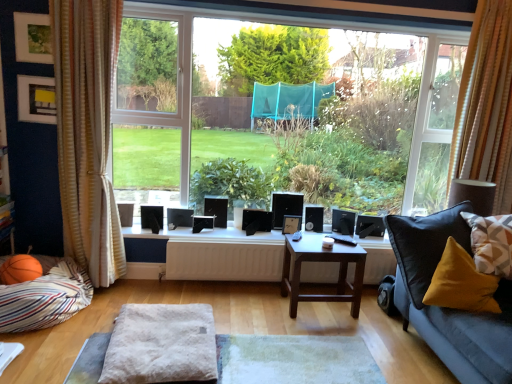
Where is `orange rubber basketball at lower left`? orange rubber basketball at lower left is located at coordinates (20, 269).

Where is `dark brown wooden table at center`? This screenshot has width=512, height=384. dark brown wooden table at center is located at coordinates (322, 261).

What do you see at coordinates (281, 111) in the screenshot?
I see `transparent glass window at center` at bounding box center [281, 111].

Identify the location of striped fabric pillow at lower left, which ranks as the first pillow in left-to-right order. Image resolution: width=512 pixels, height=384 pixels. (45, 297).

This screenshot has width=512, height=384. Identify the location of velvet yellow pillow at lower right, which appears as the second pillow when viewed from the right. (461, 283).

How much space does velvet yellow pillow at lower right, acting as the 2th pillow starting from the left, occupy horizontally?

It is 31.53 centimeters.

Identify the location of orange rubber basketball at lower left. (20, 269).

You are a GUI agent. You are given a task and a screenshot of the screen. Output one action in this format:
    pyautogui.click(x=<x>, y=<y>)
    Task: Click on the gray below the orange fabric curtain at right, which is the 2th curtain from left to right (from the image's perspective)
    
    Given the screenshot: What is the action you would take?
    pyautogui.click(x=161, y=345)

Considering the points (144, 348) and (465, 89), which point is behind, point (144, 348) or point (465, 89)?

The point (465, 89) is more distant.

Between fuzzy fabric ottoman at center and orange fabric curtain at right, arranged as the 1th curtain when viewed from the right, which one has larger size?

Bigger between the two is orange fabric curtain at right, arranged as the 1th curtain when viewed from the right.

Can we say fuzzy fabric ottoman at center lies outside orange fabric curtain at right, which is the 2th curtain from left to right?

Yes, fuzzy fabric ottoman at center is not within orange fabric curtain at right, which is the 2th curtain from left to right.

Looking at this image, can you confirm if orange rubber basketball at lower left is thinner than white glossy window sill at center?

Yes, orange rubber basketball at lower left is thinner than white glossy window sill at center.

From a real-world perspective, is orange rubber basketball at lower left above or below white glossy window sill at center?

From a real-world perspective, orange rubber basketball at lower left is physically below white glossy window sill at center.

Does orange rubber basketball at lower left have a smaller size compared to white glossy window sill at center?

Yes.

Locate an element on the screen. This screenshot has height=384, width=512. window sill that is on the right side of orange rubber basketball at lower left is located at coordinates (203, 234).

From a real-world perspective, is matte black picture frame at upper left, which is the first picture frame from left to right, physically located above or below geometric-patterned fabric pillow at right, positioned as the 1th pillow in right-to-left order?

matte black picture frame at upper left, which is the first picture frame from left to right, is above geometric-patterned fabric pillow at right, positioned as the 1th pillow in right-to-left order.

Is point (48, 110) behind point (504, 238)?

That is True.

From the image's perspective, count 2nd picture frames upward from the geometric-patterned fabric pillow at right, positioned as the 1th pillow in right-to-left order, and point to it. Please provide its 2D coordinates.

[(36, 99)]

From the image's perspective, which object appears higher, matte black picture frame at upper left, which is counted as the 2th picture frame, starting from the bottom, or geometric-patterned fabric pillow at right, placed as the 3th pillow when sorted from left to right?

matte black picture frame at upper left, which is counted as the 2th picture frame, starting from the bottom, appears higher in the image.

Is orange fabric curtain at right, arranged as the 1th curtain when viewed from the right, wider than matte green picture frame at upper left, which ranks as the third picture frame in back-to-front order?

Yes.

From the image's perspective, does orange fabric curtain at right, which is the 2th curtain from left to right, appear higher than matte green picture frame at upper left, placed as the 2th picture frame when sorted from right to left?

Incorrect, from the image's perspective, orange fabric curtain at right, which is the 2th curtain from left to right, is lower than matte green picture frame at upper left, placed as the 2th picture frame when sorted from right to left.

Looking at this image, considering the sizes of objects orange fabric curtain at right, arranged as the 1th curtain when viewed from the right, and matte green picture frame at upper left, placed as the 1th picture frame when sorted from front to back, in the image provided, who is taller, orange fabric curtain at right, arranged as the 1th curtain when viewed from the right, or matte green picture frame at upper left, placed as the 1th picture frame when sorted from front to back,?

orange fabric curtain at right, arranged as the 1th curtain when viewed from the right.

Do you think orange rubber basketball at lower left is within white matte radiator at center, or outside of it?

orange rubber basketball at lower left is outside white matte radiator at center.

Is orange rubber basketball at lower left next to white matte radiator at center?

orange rubber basketball at lower left and white matte radiator at center are not in contact.

Between orange rubber basketball at lower left and white matte radiator at center, which one has smaller width?

white matte radiator at center is thinner.

Based on the photo, considering the sizes of objects orange rubber basketball at lower left and white matte radiator at center in the image provided, who is taller, orange rubber basketball at lower left or white matte radiator at center?

white matte radiator at center is taller.

This screenshot has width=512, height=384. What are the coordinates of `curtain located on the left of fuzzy fabric ottoman at center` in the screenshot? It's located at (87, 132).

Does striped fabric curtain at left, arranged as the second curtain when viewed from the right, have a lesser height compared to fuzzy fabric ottoman at center?

No.

Would you say striped fabric curtain at left, the first curtain from the left, is to the left or to the right of fuzzy fabric ottoman at center in the picture?

striped fabric curtain at left, the first curtain from the left, is to the left of fuzzy fabric ottoman at center.

How different are the orientations of striped fabric curtain at left, arranged as the second curtain when viewed from the right, and fuzzy fabric ottoman at center in degrees?

There is a 4.51-degree angle between the facing directions of striped fabric curtain at left, arranged as the second curtain when viewed from the right, and fuzzy fabric ottoman at center.

Is matte green picture frame at upper left, placed as the 1th picture frame when sorted from front to back, outside of striped fabric curtain at left, the first curtain from the left?

Indeed, matte green picture frame at upper left, placed as the 1th picture frame when sorted from front to back, is completely outside striped fabric curtain at left, the first curtain from the left.

I want to click on the 1st picture frame counting from the left side of the striped fabric curtain at left, the first curtain from the left, so click(x=33, y=38).

How different are the orientations of matte green picture frame at upper left, placed as the 1th picture frame when sorted from front to back, and striped fabric curtain at left, the first curtain from the left, in degrees?

3.75 degrees.

Which is more to the left, matte green picture frame at upper left, placed as the 2th picture frame when sorted from right to left, or striped fabric curtain at left, the first curtain from the left?

matte green picture frame at upper left, placed as the 2th picture frame when sorted from right to left.

From a real-world perspective, which curtain is the 2nd one above the fuzzy fabric ottoman at center? Please provide its 2D coordinates.

[(486, 103)]

Locate an element on the screen. The width and height of the screenshot is (512, 384). window sill above the orange rubber basketball at lower left (from the image's perspective) is located at coordinates (203, 234).

Looking at the image, which one is located further to matte black picture frame at upper left, which is counted as the 2th picture frame, starting from the front, white glossy window sill at center or transparent glass window at center?

Based on the image, transparent glass window at center appears to be further to matte black picture frame at upper left, which is counted as the 2th picture frame, starting from the front.

Which object lies nearer to the anchor point white glossy window sill at center, orange fabric curtain at right, arranged as the 1th curtain when viewed from the right, or dark brown wooden table at center?

Among the two, dark brown wooden table at center is located nearer to white glossy window sill at center.

Looking at the image, which one is located further to matte green picture frame at upper left, placed as the 2th picture frame when sorted from right to left, striped fabric pillow at lower left, which ranks as the first pillow in left-to-right order, or white glossy window sill at center?

striped fabric pillow at lower left, which ranks as the first pillow in left-to-right order.

Estimate the real-world distances between objects in this image. Which object is closer to wooden picture frame at center, arranged as the 1th picture frame when ordered from the bottom, matte black picture frame at upper left, which is counted as the 2th picture frame, starting from the bottom, or orange fabric curtain at right, which is the 2th curtain from left to right?

The object closer to wooden picture frame at center, arranged as the 1th picture frame when ordered from the bottom, is orange fabric curtain at right, which is the 2th curtain from left to right.

Looking at the image, which one is located further to velvet yellow pillow at lower right, acting as the 2th pillow starting from the left, wooden picture frame at center, the first picture frame in the back-to-front sequence, or orange rubber basketball at lower left?

orange rubber basketball at lower left lies further to velvet yellow pillow at lower right, acting as the 2th pillow starting from the left, than the other object.

Which object lies further to the anchor point striped fabric pillow at lower left, which ranks as the first pillow in left-to-right order, dark brown wooden table at center or matte green picture frame at upper left, positioned as the first picture frame in top-to-bottom order?

dark brown wooden table at center is further to striped fabric pillow at lower left, which ranks as the first pillow in left-to-right order.

In the scene shown: Estimate the real-world distances between objects in this image. Which object is closer to striped fabric curtain at left, arranged as the second curtain when viewed from the right, wooden picture frame at center, the 3th picture frame when ordered from top to bottom, or dark brown wooden table at center?

dark brown wooden table at center is positioned closer to the anchor striped fabric curtain at left, arranged as the second curtain when viewed from the right.

Looking at the image, which one is located further to matte black picture frame at upper left, arranged as the 2th picture frame when viewed from the back, velvet yellow pillow at lower right, acting as the 2th pillow starting from the left, or striped fabric pillow at lower left, which ranks as the first pillow in left-to-right order?

velvet yellow pillow at lower right, acting as the 2th pillow starting from the left.

Where is `window between striped fabric pillow at lower left, which ranks as the first pillow in left-to-right order, and dark brown wooden table at center, in the horizontal direction`? This screenshot has height=384, width=512. window between striped fabric pillow at lower left, which ranks as the first pillow in left-to-right order, and dark brown wooden table at center, in the horizontal direction is located at coordinates (281, 111).

Where is `basketball situated between matte green picture frame at upper left, positioned as the first picture frame in top-to-bottom order, and dark brown wooden table at center from left to right`? This screenshot has width=512, height=384. basketball situated between matte green picture frame at upper left, positioned as the first picture frame in top-to-bottom order, and dark brown wooden table at center from left to right is located at coordinates (20, 269).

Find the location of `pillow located between matte black picture frame at upper left, which is counted as the 2th picture frame, starting from the front, and transparent glass window at center in the left-right direction`. pillow located between matte black picture frame at upper left, which is counted as the 2th picture frame, starting from the front, and transparent glass window at center in the left-right direction is located at coordinates (45, 297).

Find the location of a particular element. This screenshot has width=512, height=384. gray between matte black picture frame at upper left, which is counted as the 2th picture frame, starting from the bottom, and dark brown wooden table at center is located at coordinates (161, 345).